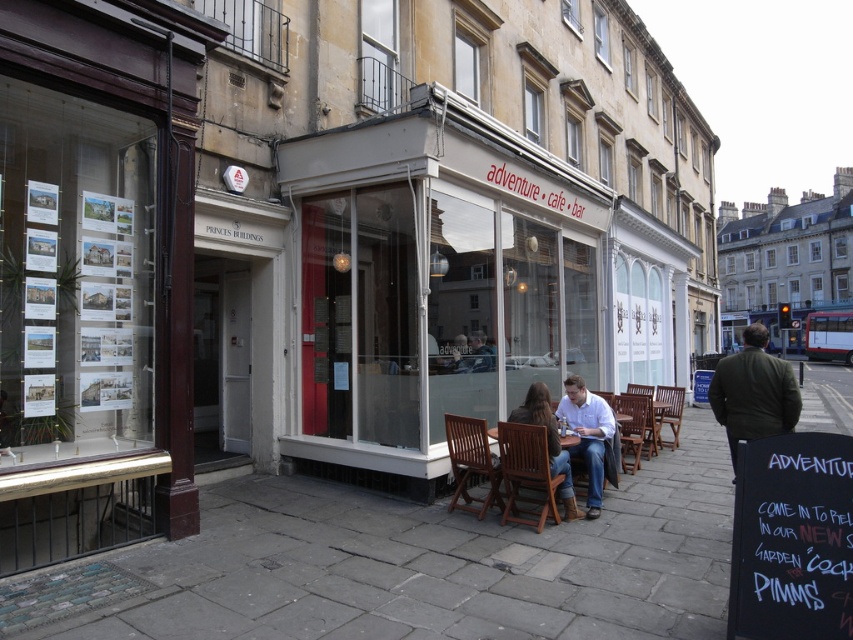
You are standing at the corner of the street where the Adventure Cafe Bar is located. You see two points marked on the ground. The first point is at coordinate point (787, 403) and the second point is at coordinate point (566, 515). If you want to walk towards the point that is closer to you, which point should you head towards?

Point (787, 403) is in front of point (566, 515), so you should head towards point (787, 403) as it is closer to you.